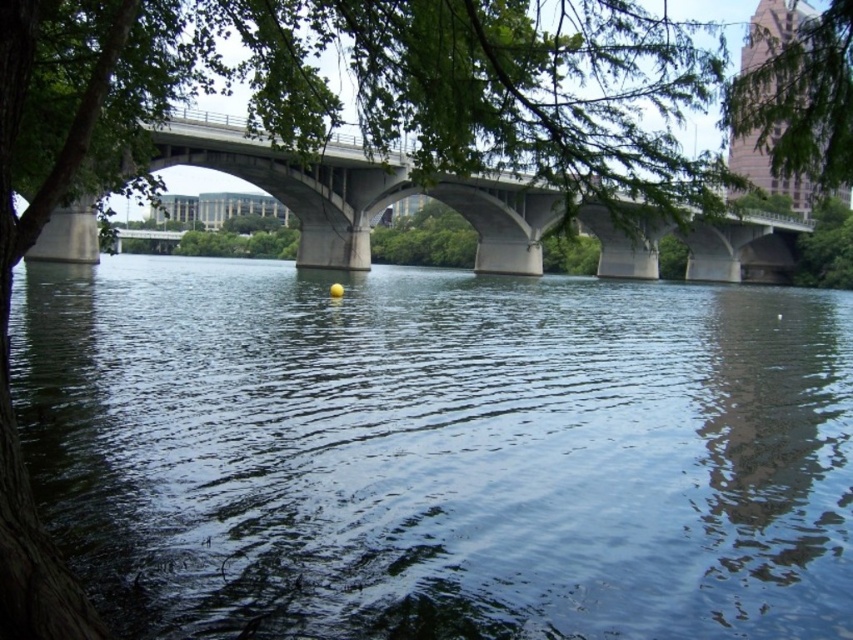
You are standing at the point marked by coordinates point (438, 451) in the riverside scene. What is the immediate environment around this point like?

The dark blue water at center is represented by point (438, 451), so the immediate environment around this point is dark blue water.

You are a photographer standing at the riverside. You want to capture a photo where the dark blue water at center is in focus while keeping the concrete bridge at center in the background. Is this possible based on their positions?

Yes, since the dark blue water at center is closer to the viewer than the concrete bridge at center, you can focus on the water and have the bridge naturally blur into the background.